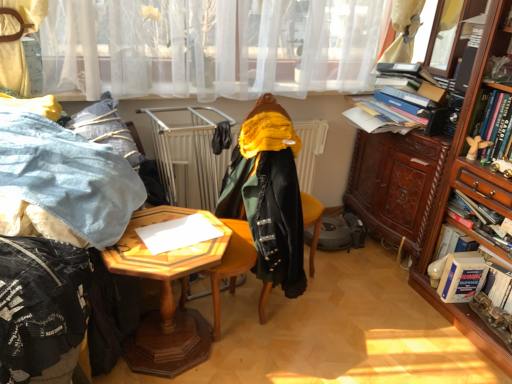
Image resolution: width=512 pixels, height=384 pixels. I want to click on vacant area that lies to the right of wooden hexagonal table at center, so click(273, 356).